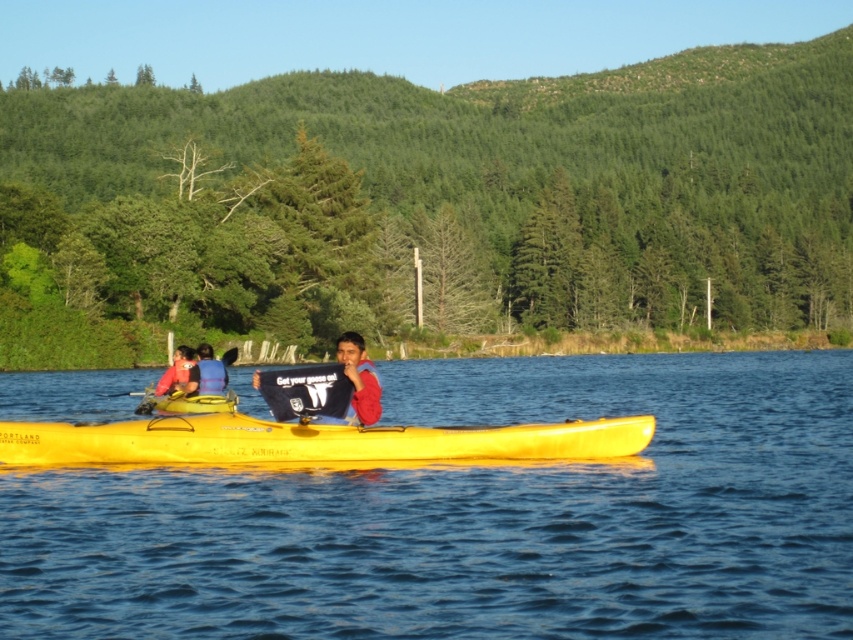
You are a photographer positioned at the blue fabric at left and want to capture the yellow plastic kayak at center in your shot. Given that your camera has a minimum focusing distance of 20 meters, will you be able to take a clear photo of the kayak?

The yellow plastic kayak at center is 19.85 meters from blue fabric at left, which is just below the camera minimum focusing distance of 20 meters. Therefore, you might not be able to take a clear photo of the kayak from the blue fabric at left.

You are a photographer trying to capture a photo of the blue fabric at left and the matte pink shirt at left. Which one should you focus on if you want to include both in the frame without cropping?

The blue fabric at left is bigger than the matte pink shirt at left, so you should focus on the blue fabric at left to ensure both fit in the frame.

In the scene shown: You are a photographer trying to capture the yellow plastic kayak at center and the blue fabric at left in your shot. Which object should you focus on first to ensure both are in the frame?

The yellow plastic kayak at center is in front of the blue fabric at left, so you should focus on the yellow plastic kayak at center first to ensure both are in the frame.